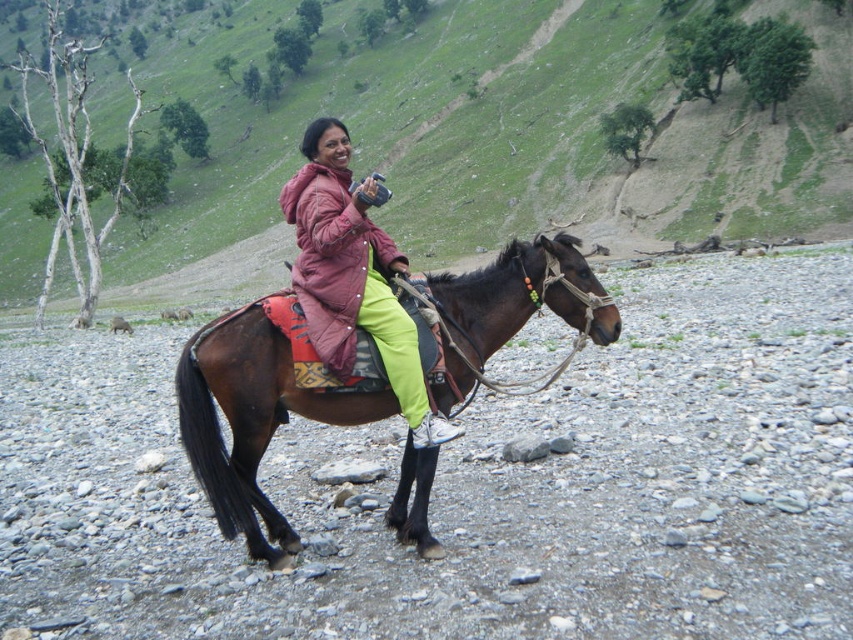
Question: Considering the relative positions of brown horse at center and matte pink jacket at center in the image provided, where is brown horse at center located with respect to matte pink jacket at center?

Choices:
 (A) below
 (B) above

Answer: (B)

Question: From the image, what is the correct spatial relationship of brown horse at center in relation to matte pink jacket at center?

Choices:
 (A) left
 (B) right

Answer: (A)

Question: Which of the following is the closest to the observer?

Choices:
 (A) brown horse at center
 (B) matte pink jacket at center

Answer: (B)

Question: Is brown horse at center to the right of matte pink jacket at center from the viewer's perspective?

Choices:
 (A) no
 (B) yes

Answer: (A)

Question: Which point is farther to the camera?

Choices:
 (A) matte pink jacket at center
 (B) brown horse at center
 (C) brown glossy horse at center

Answer: (B)

Question: Which object is the closest to the matte pink jacket at center?

Choices:
 (A) brown glossy horse at center
 (B) brown horse at center

Answer: (A)